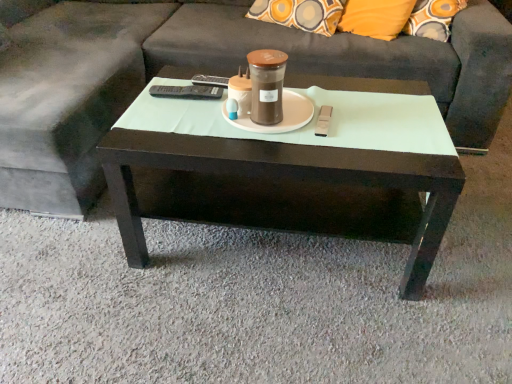
Find the location of a particular element. The width and height of the screenshot is (512, 384). free space to the left of brown matte jar at center is located at coordinates (192, 122).